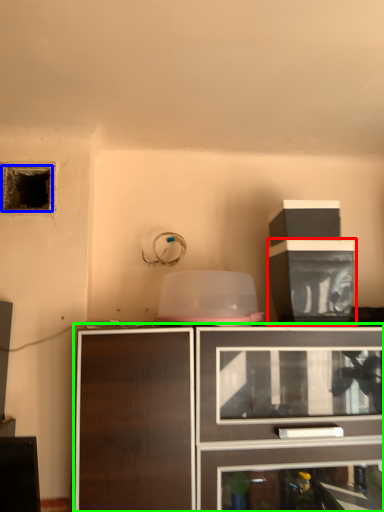
Question: Which is nearer to the cabinetry (highlighted by a red box)? hole (highlighted by a blue box) or cabinetry (highlighted by a green box).

Choices:
 (A) hole
 (B) cabinetry

Answer: (B)